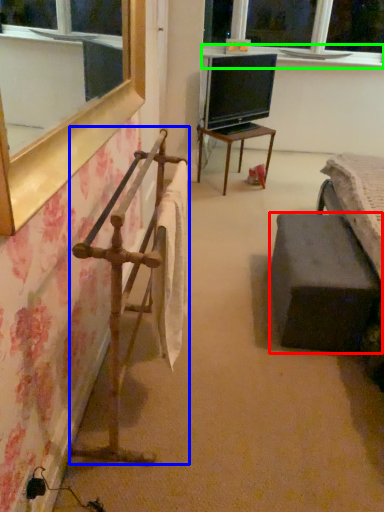
Question: Which is farther away from furniture (highlighted by a red box)? rail (highlighted by a blue box) or window sill (highlighted by a green box)?

Choices:
 (A) rail
 (B) window sill

Answer: (B)